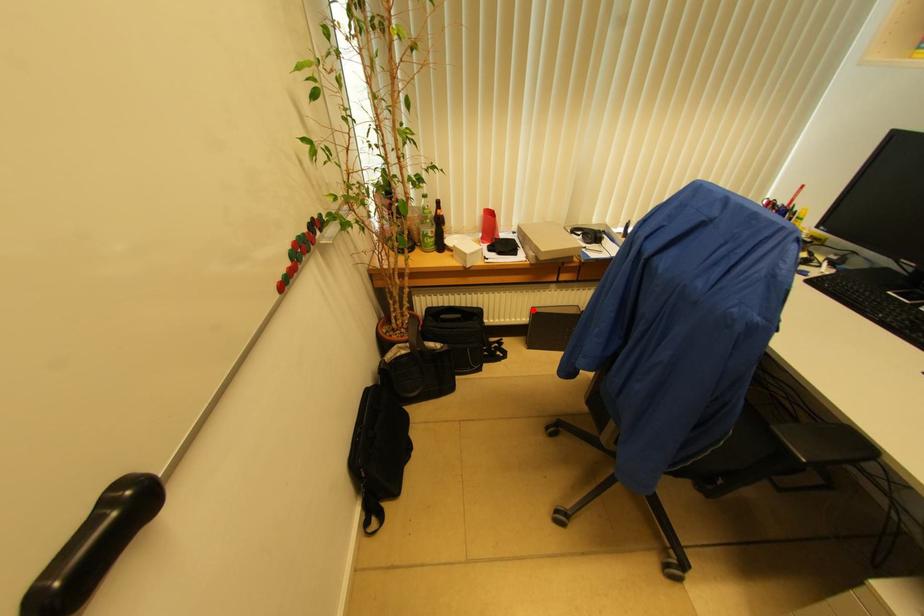
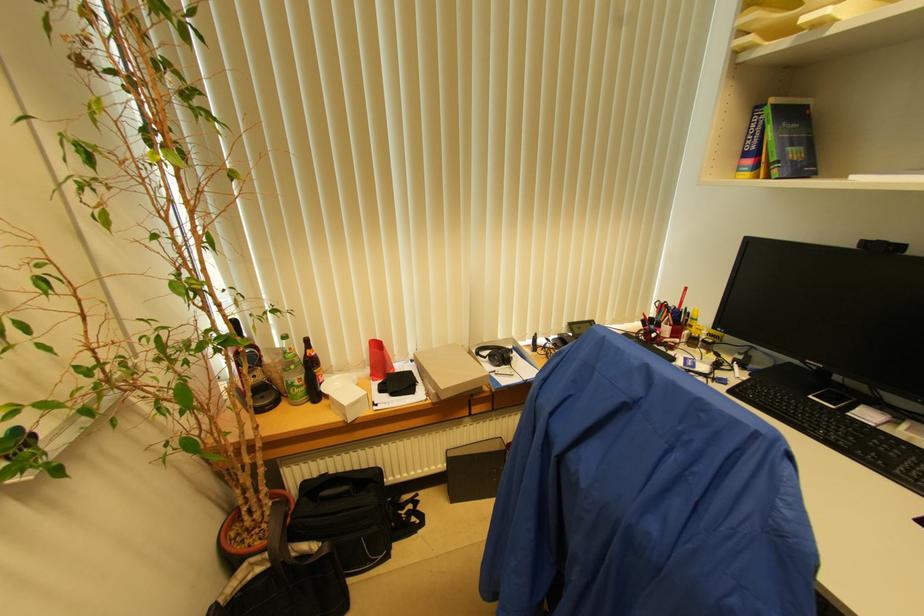
Question: I am providing you with two images of the same scene from different viewpoints. A red point is marked on the first image. Is the red point's position out of view in image 2?

Choices:
 (A) Yes
 (B) No

Answer: (B)